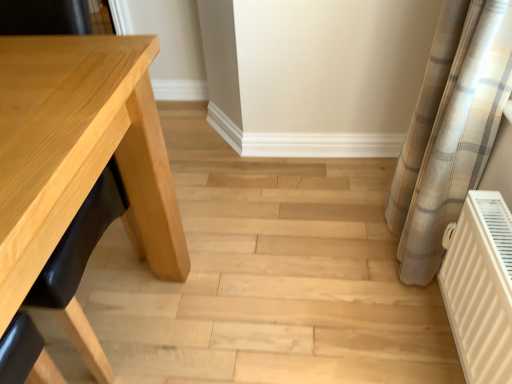
Question: Are plaid fabric curtain at right and natural wood table at left beside each other?

Choices:
 (A) no
 (B) yes

Answer: (A)

Question: Is plaid fabric curtain at right taller than natural wood table at left?

Choices:
 (A) no
 (B) yes

Answer: (B)

Question: From the image's perspective, is plaid fabric curtain at right on top of natural wood table at left?

Choices:
 (A) no
 (B) yes

Answer: (B)

Question: Is plaid fabric curtain at right aimed at natural wood table at left?

Choices:
 (A) no
 (B) yes

Answer: (A)

Question: Can you confirm if plaid fabric curtain at right is positioned to the right of natural wood table at left?

Choices:
 (A) yes
 (B) no

Answer: (A)

Question: Considering their positions, is light wood table at left located in front of or behind plaid fabric curtain at right?

Choices:
 (A) behind
 (B) front

Answer: (B)

Question: In the image, is light wood table at left on the left side or the right side of plaid fabric curtain at right?

Choices:
 (A) right
 (B) left

Answer: (B)

Question: Does point (32, 211) appear closer or farther from the camera than point (454, 165)?

Choices:
 (A) closer
 (B) farther

Answer: (A)

Question: Looking at their shapes, would you say light wood table at left is wider or thinner than plaid fabric curtain at right?

Choices:
 (A) thin
 (B) wide

Answer: (B)

Question: Based on their positions, is white matte radiator at lower right located to the left or right of light wood table at left?

Choices:
 (A) right
 (B) left

Answer: (A)

Question: From the image's perspective, is white matte radiator at lower right located above or below light wood table at left?

Choices:
 (A) below
 (B) above

Answer: (A)

Question: From their relative heights in the image, would you say white matte radiator at lower right is taller or shorter than light wood table at left?

Choices:
 (A) tall
 (B) short

Answer: (B)

Question: Is white matte radiator at lower right inside the boundaries of light wood table at left, or outside?

Choices:
 (A) inside
 (B) outside

Answer: (B)

Question: Is light wood table at left situated inside white matte radiator at lower right or outside?

Choices:
 (A) inside
 (B) outside

Answer: (B)

Question: Considering the positions of light wood table at left and white matte radiator at lower right in the image, is light wood table at left taller or shorter than white matte radiator at lower right?

Choices:
 (A) short
 (B) tall

Answer: (B)